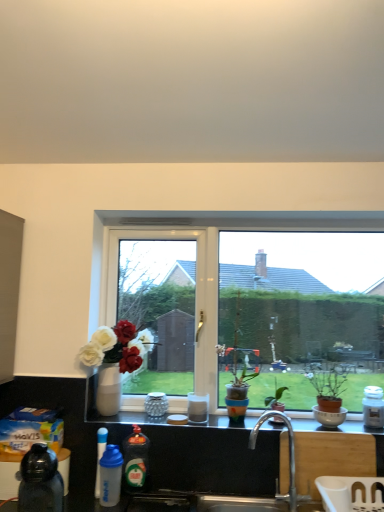
Identify the location of vacant space to the right of white glossy coffee cup at center, placed as the 1th coffee cup when sorted from right to left. (227, 425).